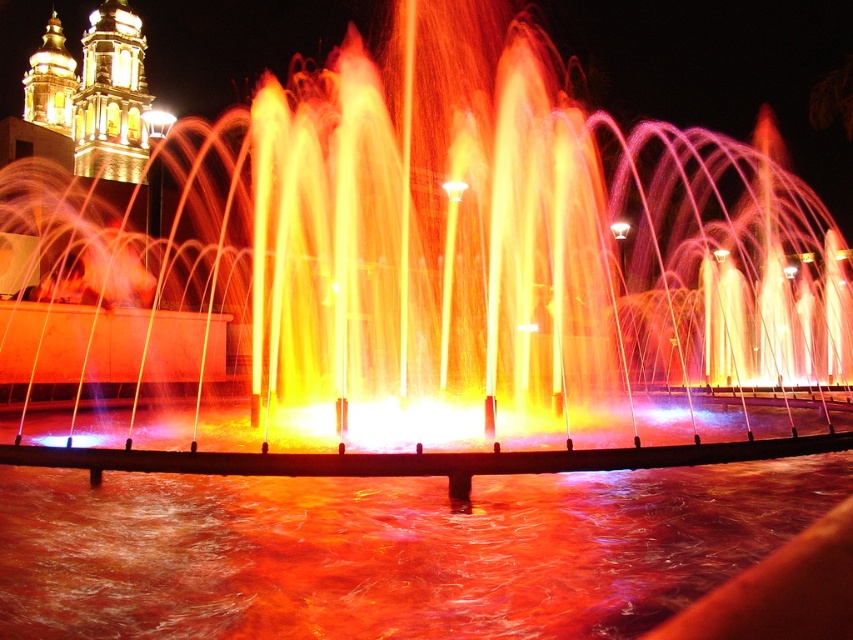
Question: Can you confirm if metallic water jets at center is positioned above shiny orange water at center?

Choices:
 (A) yes
 (B) no

Answer: (A)

Question: Is the position of metallic water jets at center less distant than that of shiny orange water at center?

Choices:
 (A) no
 (B) yes

Answer: (A)

Question: Which point is closer to the camera taking this photo?

Choices:
 (A) (366, 465)
 (B) (561, 624)

Answer: (B)

Question: Is metallic water jets at center smaller than shiny orange water at center?

Choices:
 (A) yes
 (B) no

Answer: (B)